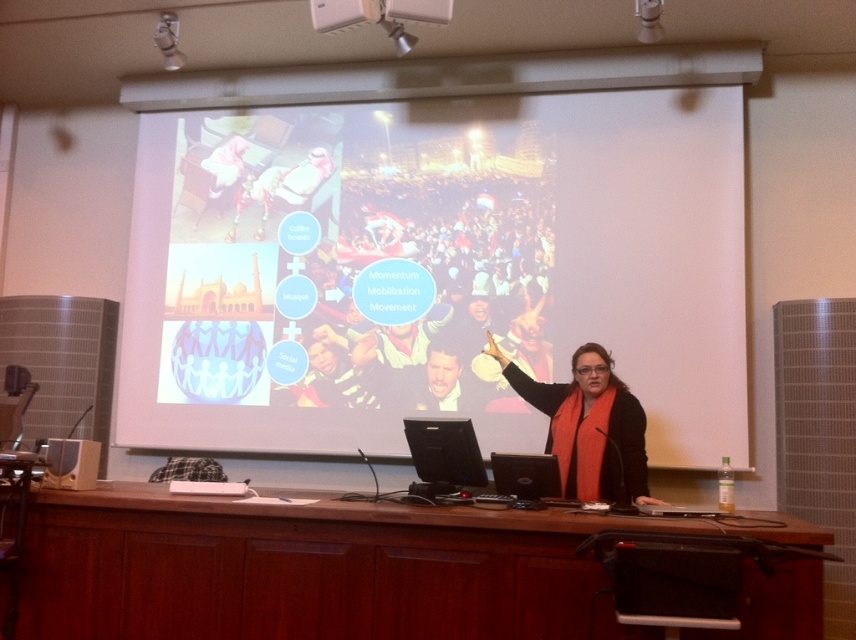
Question: Observing the image, what is the correct spatial positioning of brown wood table at center in reference to black fabric at center?

Choices:
 (A) above
 (B) below

Answer: (B)

Question: Considering the relative positions of black fabric at center and matte black laptop at lower left in the image provided, where is black fabric at center located with respect to matte black laptop at lower left?

Choices:
 (A) below
 (B) above

Answer: (B)

Question: Which of the following is the farthest from the observer?

Choices:
 (A) white matte projection screen at upper center
 (B) black fabric at center

Answer: (A)

Question: Where is white matte projection screen at upper center located in relation to black fabric at center in the image?

Choices:
 (A) above
 (B) below

Answer: (A)

Question: Which object is positioned closest to the matte black laptop at lower left?

Choices:
 (A) black fabric at center
 (B) white matte projection screen at upper center
 (C) matte black laptop at center

Answer: (C)

Question: Which point is closer to the camera?

Choices:
 (A) matte black laptop at center
 (B) black fabric at center

Answer: (B)